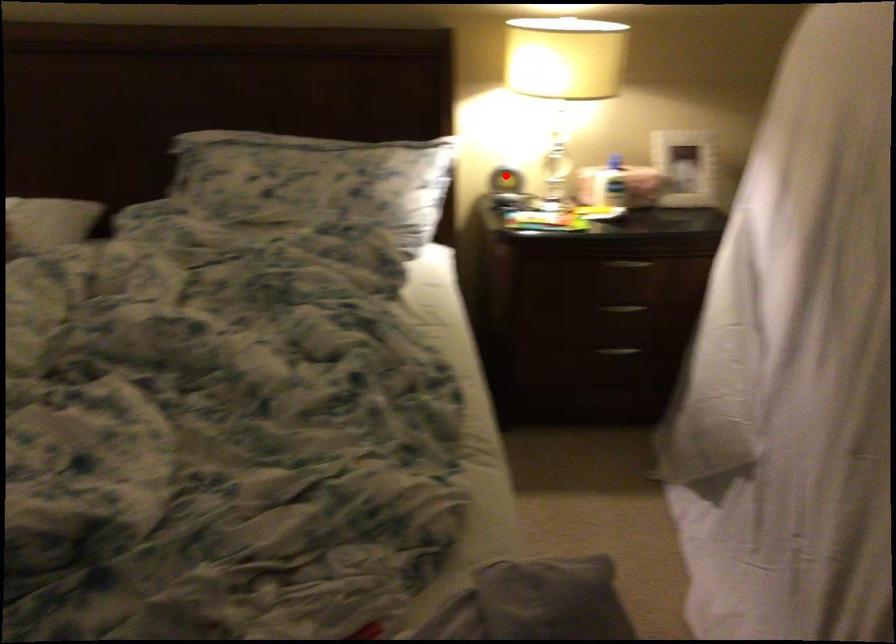
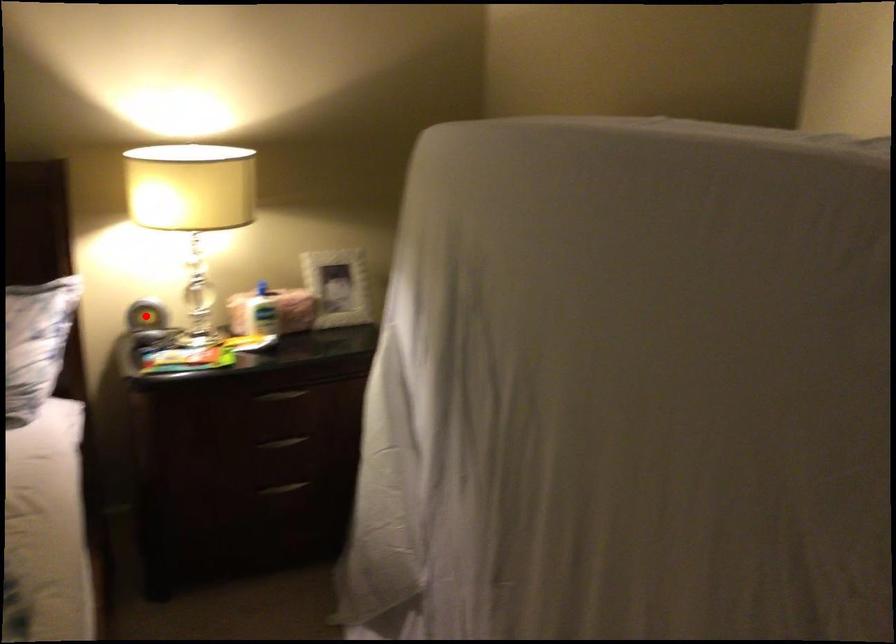
I am providing you with two images of the same scene from different viewpoints. A red point is marked on the first image and another point is marked on the second image. Is the red point in image1 aligned with the point shown in image2?

Yes